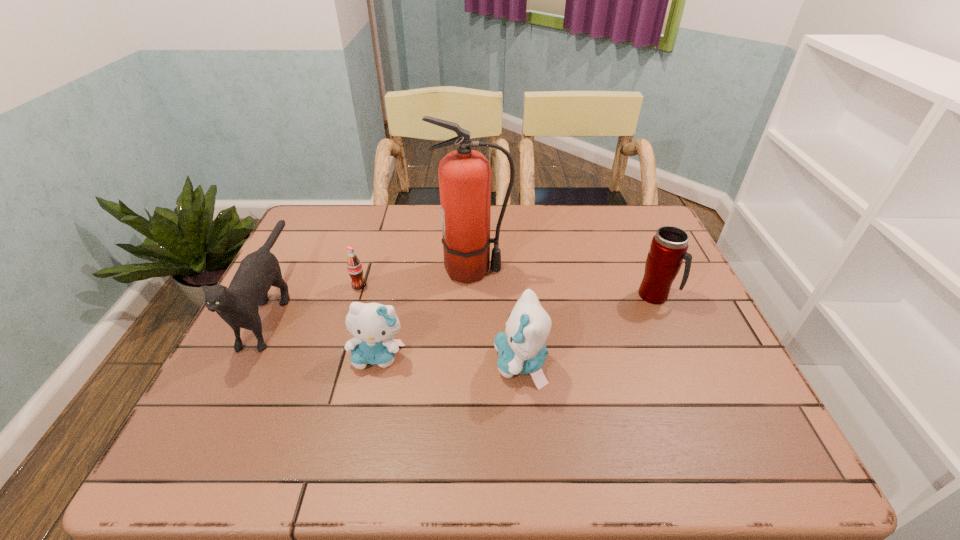
This screenshot has height=540, width=960. In order to click on vacant area that lies between the shortest object and the thermos bottle in this screenshot , I will do `click(507, 291)`.

Image resolution: width=960 pixels, height=540 pixels. What are the coordinates of `free space between the taller kitten and the fire extinguisher` in the screenshot? It's located at (496, 317).

Where is `free area in between the thermos bottle and the right kitten`? The height and width of the screenshot is (540, 960). free area in between the thermos bottle and the right kitten is located at coordinates (588, 329).

You are a GUI agent. You are given a task and a screenshot of the screen. Output one action in this format:
    pyautogui.click(x=<x>, y=<y>)
    Task: Click on the blank region between the thermos bottle and the leftmost object
    This screenshot has height=540, width=960.
    Given the screenshot: What is the action you would take?
    pyautogui.click(x=464, y=301)

Identify the location of free space between the taller kitten and the shortest object. (440, 325).

Point out which object is positioned as the fifth nearest to the fire extinguisher. Please provide its 2D coordinates. Your answer should be formatted as a tuple, i.e. [(x, y)], where the tuple contains the x and y coordinates of a point satisfying the conditions above.

[(238, 305)]

This screenshot has width=960, height=540. In order to click on object identified as the fourth closest to the left kitten in this screenshot , I will do `click(522, 350)`.

Where is `vacant space that satisfies the following two spatial constraints: 1. on the side with the handle of the thermos bottle; 2. on the face of the fourth object from right to left`? The width and height of the screenshot is (960, 540). vacant space that satisfies the following two spatial constraints: 1. on the side with the handle of the thermos bottle; 2. on the face of the fourth object from right to left is located at coordinates (682, 356).

This screenshot has width=960, height=540. In order to click on vacant point that satisfies the following two spatial constraints: 1. on the nozzle of the tallest object; 2. on the front-facing side of the leftmost object in this screenshot , I will do `click(471, 306)`.

Find the location of `blank space that satisfies the following two spatial constraints: 1. on the nozzle of the tallest object; 2. on the front side of the fifth object from right to left`. blank space that satisfies the following two spatial constraints: 1. on the nozzle of the tallest object; 2. on the front side of the fifth object from right to left is located at coordinates (472, 285).